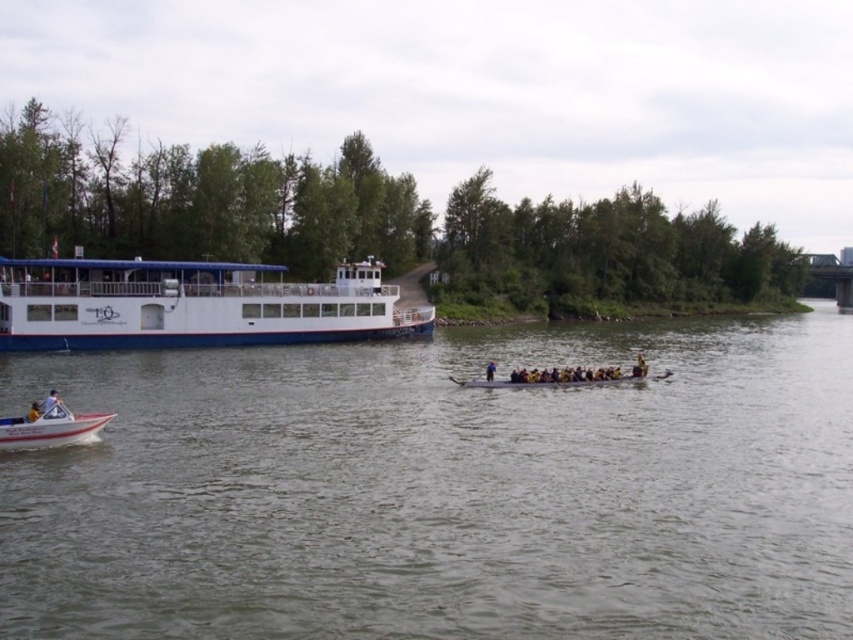
Is white glossy ferry at left shorter than white fabric shirt at lower left?

Incorrect, white glossy ferry at left's height does not fall short of white fabric shirt at lower left's.

Between point (161, 300) and point (56, 397), which one is positioned in front?

Point (56, 397) is more forward.

The width and height of the screenshot is (853, 640). Find the location of `white glossy ferry at left`. white glossy ferry at left is located at coordinates (192, 305).

Does yellow fabric person at lower left appear on the left side of yellow life jackets at center?

Indeed, yellow fabric person at lower left is positioned on the left side of yellow life jackets at center.

Between point (33, 416) and point (491, 362), which one is positioned behind?

Point (491, 362)

This screenshot has height=640, width=853. In order to click on yellow fabric person at lower left in this screenshot , I will do `click(33, 412)`.

Who is higher up, greenish-gray water at center or white glossy ferry at left?

white glossy ferry at left

Does greenish-gray water at center appear on the left side of white glossy ferry at left?

No, greenish-gray water at center is not to the left of white glossy ferry at left.

Is point (492, 426) farther from camera compared to point (62, 308)?

That is False.

Where is `greenish-gray water at center`? This screenshot has height=640, width=853. greenish-gray water at center is located at coordinates (442, 490).